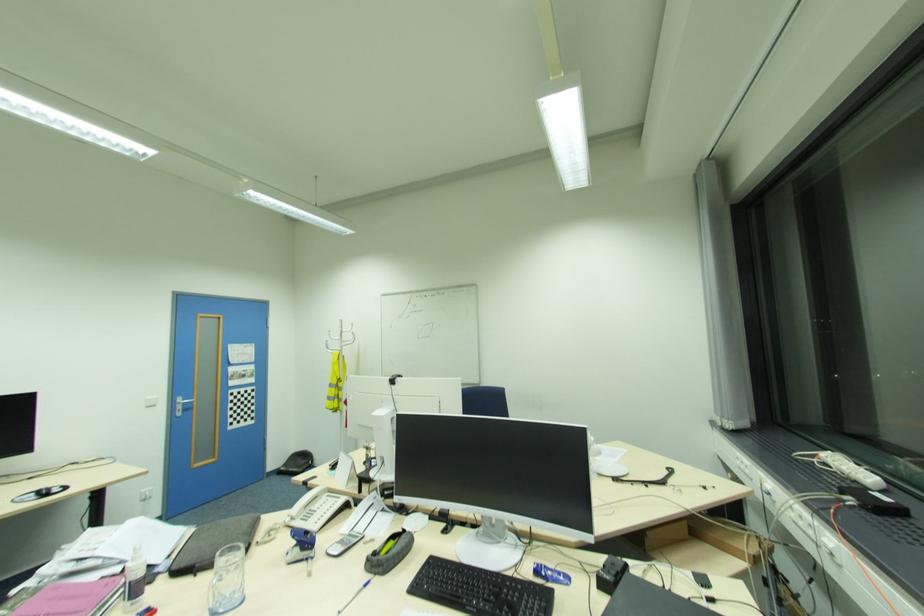
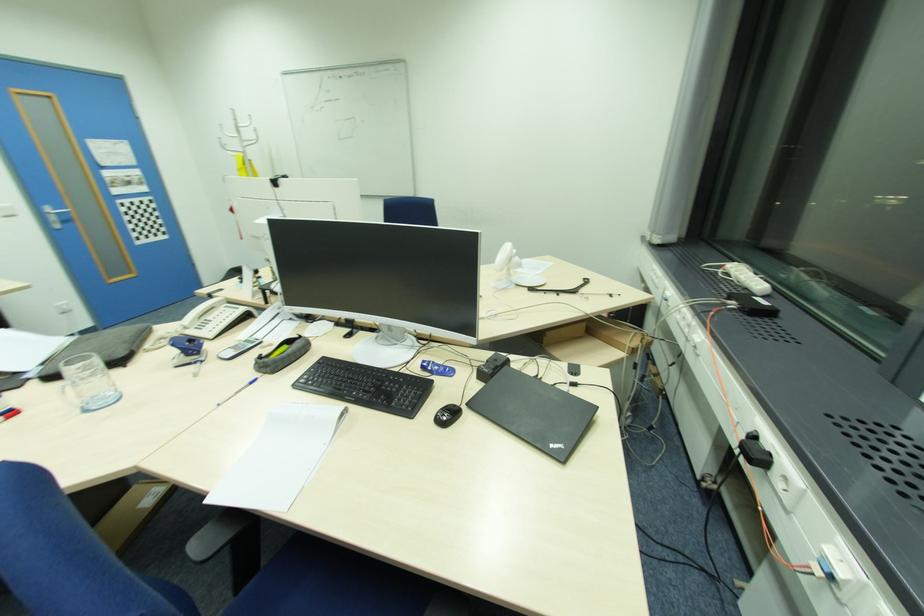
Find the pixel in the second image that matches pixel 308 483 in the first image.

(213, 294)